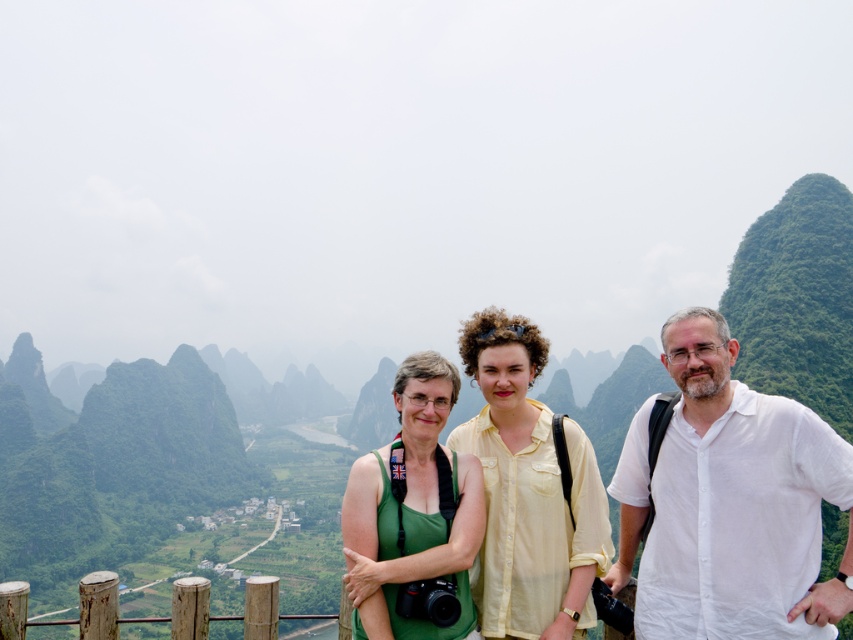
You are standing at the viewpoint with three tourists. You notice a point marked at coordinates (738, 502) on your map. Which tourist is wearing a white cotton shirt located at the right side?

The point at coordinates (738, 502) corresponds to the white cotton shirt at right.

You are a photographer trying to capture the group of tourists at the scenic viewpoint. You need to position yourself so that the white cotton shirt at right and the brown wood fence at lower left are both visible in the frame. Based on their positions, which side of the fence should you stand to include both subjects?

To include both the white cotton shirt at right and the brown wood fence at lower left in the frame, you should position yourself to the left of the brown wood fence at lower left. This allows the photographer to capture the white cotton shirt at right, which is positioned to the right of the fence, while still framing the fence itself within the shot.